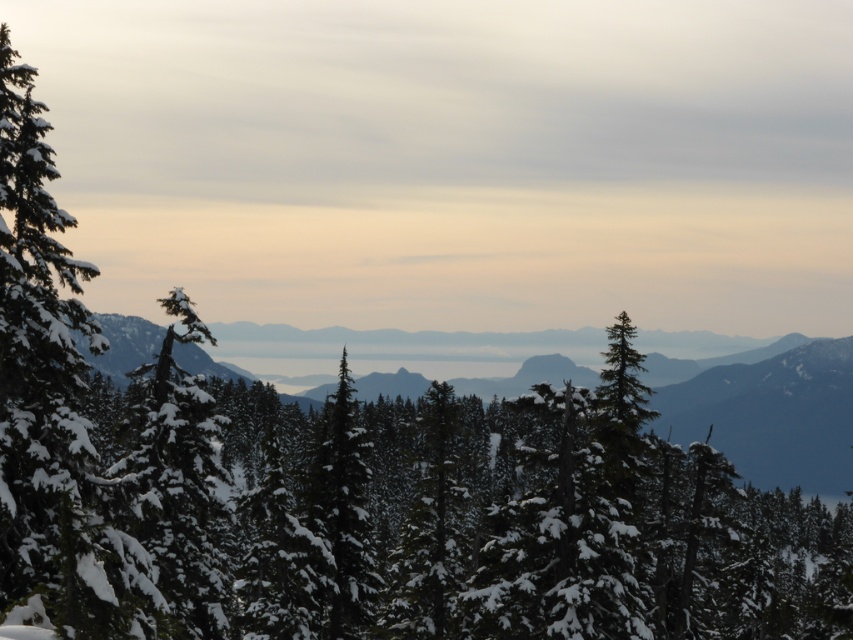
Looking at this image, between snow-covered evergreen at left and green matte tree at center, which one is positioned lower?

Positioned lower is green matte tree at center.

Does snow-covered evergreen at left have a smaller size compared to green matte tree at center?

Actually, snow-covered evergreen at left might be larger than green matte tree at center.

The image size is (853, 640). I want to click on snow-covered evergreen at left, so click(178, 483).